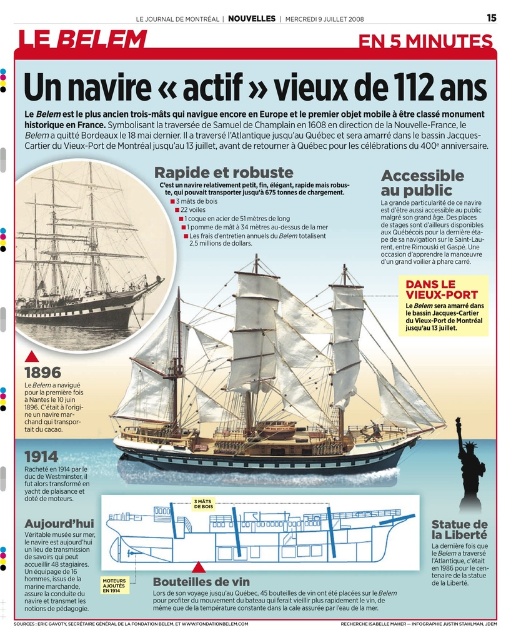
You are standing on a dock and looking at the wooden ship at center. If you want to throw a small object to someone on the ship, would the distance be too far for a typical human to throw?

The wooden ship at center is 56.39 meters away from viewer. A typical human can throw an object about 40 meters, so the distance is too far for a typical human to throw.

Based on the scene description, which ship is closer to the observer between the wooden ship at center and the rustic wood ship at center?

The wooden ship at center is closer to the observer because it is in front of the rustic wood ship at center.